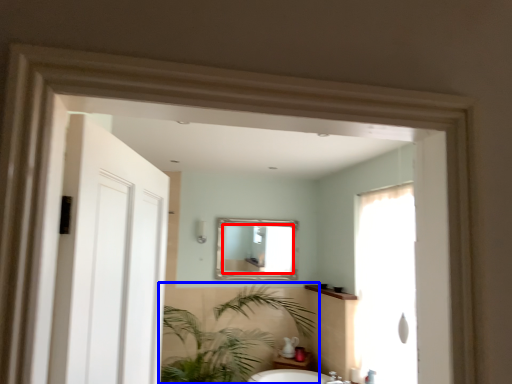
Question: Which object appears farthest to the camera in this image, mirror (highlighted by a red box) or houseplant (highlighted by a blue box)?

Choices:
 (A) mirror
 (B) houseplant

Answer: (A)